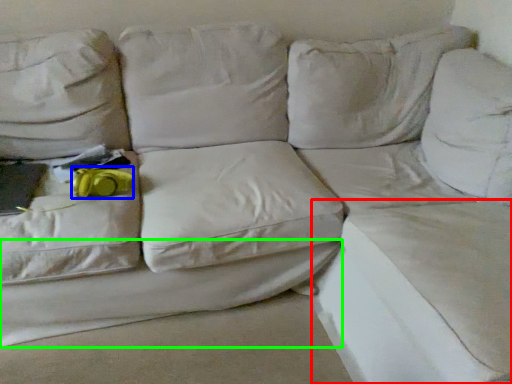
Question: Based on their relative distances, which object is nearer to sheet (highlighted by a red box)? Choose from stuff (highlighted by a blue box) and sheet (highlighted by a green box).

Choices:
 (A) stuff
 (B) sheet

Answer: (B)